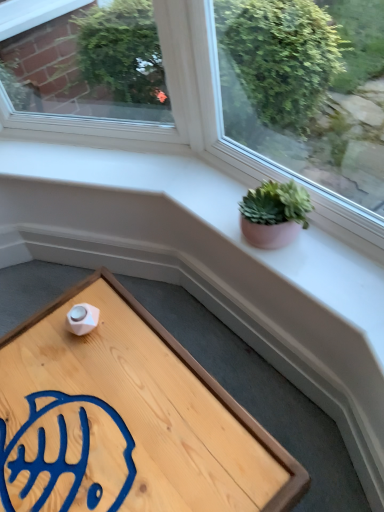
Question: Would you say green succulent in clay pot at upper right contains wooden tray at lower left?

Choices:
 (A) no
 (B) yes

Answer: (A)

Question: Is green succulent in clay pot at upper right in front of wooden tray at lower left?

Choices:
 (A) no
 (B) yes

Answer: (A)

Question: From a real-world perspective, is green succulent in clay pot at upper right on top of wooden tray at lower left?

Choices:
 (A) no
 (B) yes

Answer: (B)

Question: Does green succulent in clay pot at upper right appear on the left side of wooden tray at lower left?

Choices:
 (A) no
 (B) yes

Answer: (A)

Question: From a real-world perspective, is green succulent in clay pot at upper right positioned under wooden tray at lower left based on gravity?

Choices:
 (A) yes
 (B) no

Answer: (B)

Question: Considering the relative sizes of green succulent in clay pot at upper right and wooden tray at lower left in the image provided, is green succulent in clay pot at upper right smaller than wooden tray at lower left?

Choices:
 (A) yes
 (B) no

Answer: (A)

Question: From the image's perspective, does wooden tray at lower left appear higher than green succulent in clay pot at upper right?

Choices:
 (A) no
 (B) yes

Answer: (A)

Question: Could you tell me if wooden tray at lower left is facing green succulent in clay pot at upper right?

Choices:
 (A) yes
 (B) no

Answer: (B)

Question: Is wooden tray at lower left at the right side of green succulent in clay pot at upper right?

Choices:
 (A) yes
 (B) no

Answer: (B)

Question: Are wooden tray at lower left and green succulent in clay pot at upper right located far from each other?

Choices:
 (A) no
 (B) yes

Answer: (A)

Question: Is wooden tray at lower left wider than green succulent in clay pot at upper right?

Choices:
 (A) yes
 (B) no

Answer: (A)

Question: Is green succulent in clay pot at upper right surrounded by wooden tray at lower left?

Choices:
 (A) yes
 (B) no

Answer: (B)

Question: Is green succulent in clay pot at upper right bigger or smaller than wooden tray at lower left?

Choices:
 (A) small
 (B) big

Answer: (A)